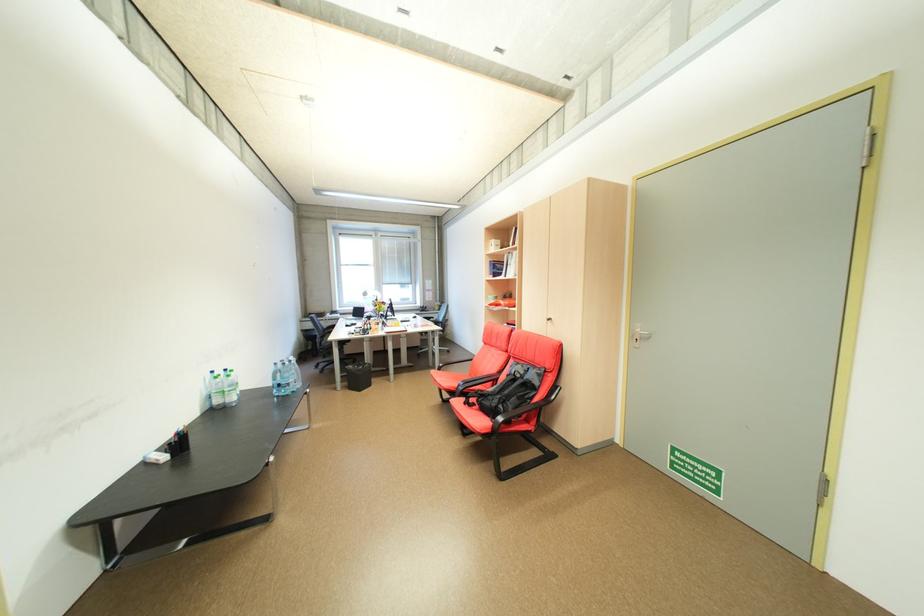
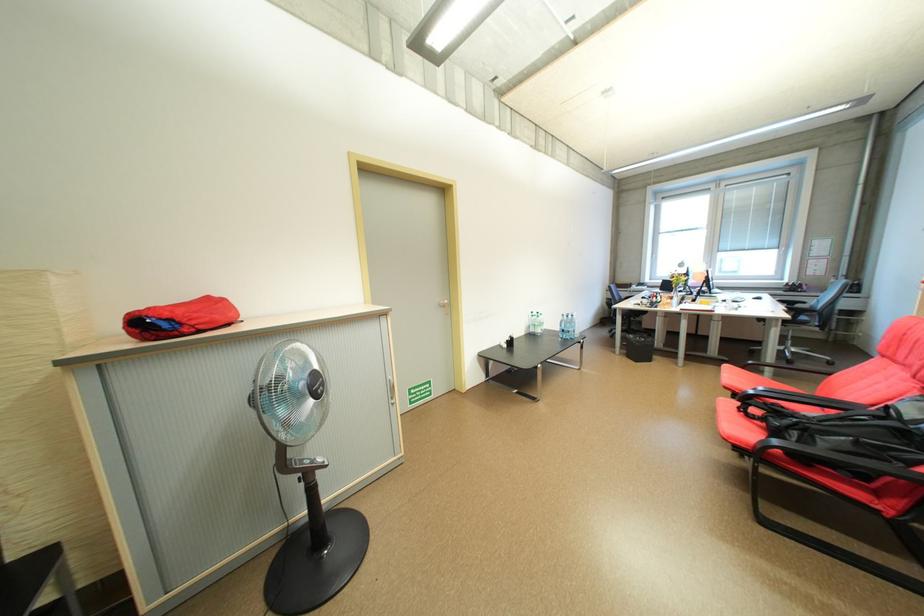
The point at (226, 402) is marked in the first image. Where is the corresponding point in the second image?

(541, 331)